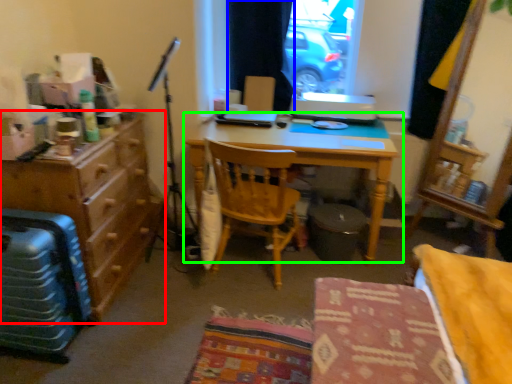
Question: Which object is the farthest from cabinetry (highlighted by a red box)? Choose among these: curtain (highlighted by a blue box) or desk (highlighted by a green box).

Choices:
 (A) curtain
 (B) desk

Answer: (A)